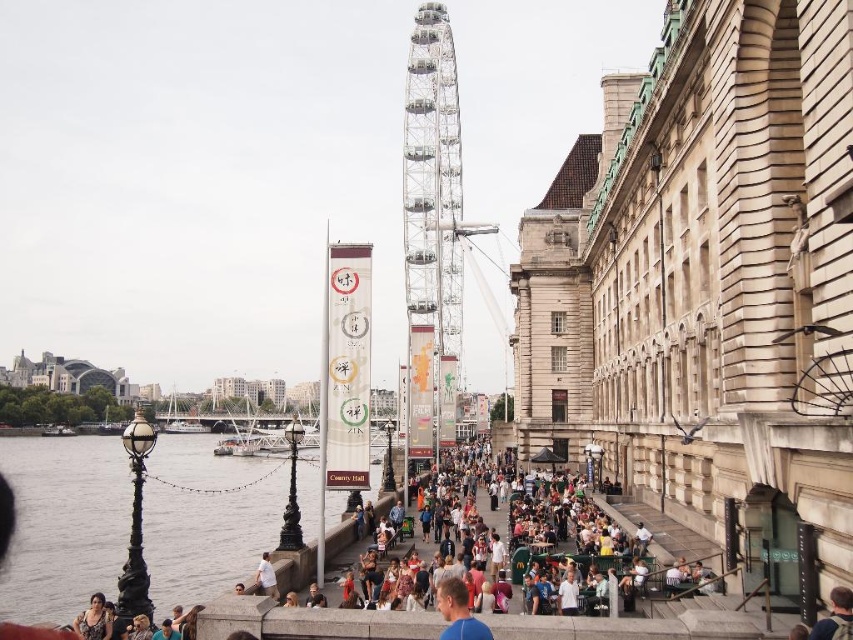
Question: Can you confirm if white metallic ferris wheel at center is positioned below white fabric shirt at lower center?

Choices:
 (A) no
 (B) yes

Answer: (A)

Question: Estimate the real-world distances between objects in this image. Which object is farther from the matte black dress at lower left?

Choices:
 (A) white fabric shirt at lower center
 (B) white metallic ferris wheel at center
 (C) smooth gray water at lower left

Answer: (B)

Question: Does matte black dress at lower left have a larger size compared to white fabric shirt at lower center?

Choices:
 (A) yes
 (B) no

Answer: (A)

Question: Which object is closer to the camera taking this photo?

Choices:
 (A) matte black dress at lower left
 (B) smooth gray water at lower left
 (C) white fabric shirt at lower center

Answer: (B)

Question: Estimate the real-world distances between objects in this image. Which object is closer to the white metallic ferris wheel at center?

Choices:
 (A) smooth gray water at lower left
 (B) matte black dress at lower left
 (C) white fabric shirt at lower center

Answer: (A)

Question: Is white metallic ferris wheel at center smaller than white fabric shirt at lower center?

Choices:
 (A) no
 (B) yes

Answer: (A)